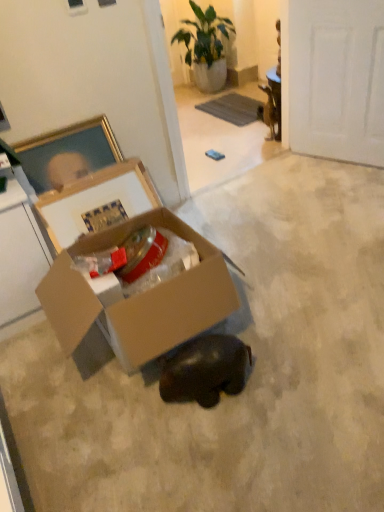
Find the location of a particular element. free area in between white matte door at upper right and cardboard box at center is located at coordinates (301, 216).